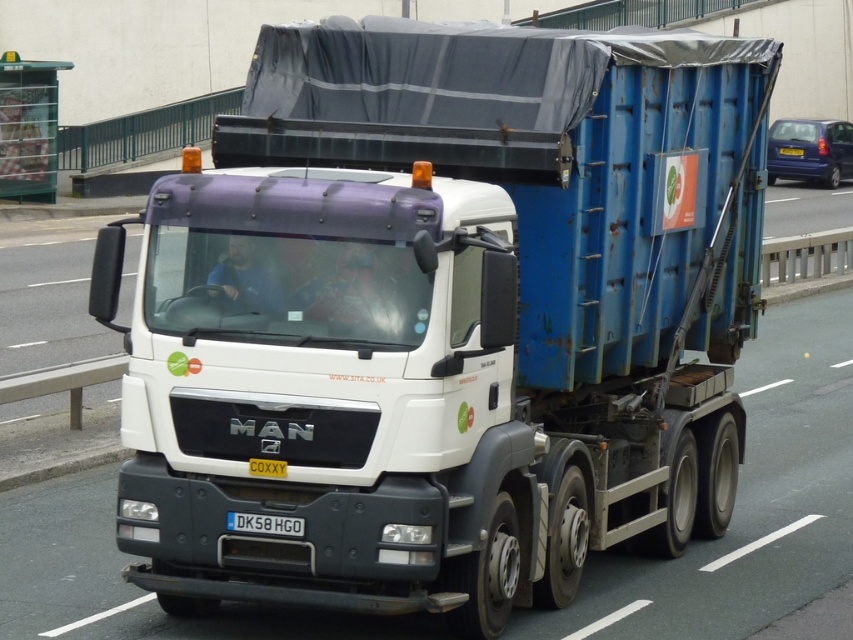
Does black plastic license plate at bottom have a lesser height compared to white plastic license plate at center?

Incorrect, black plastic license plate at bottom's height does not fall short of white plastic license plate at center's.

Which of these two, black plastic license plate at bottom or white plastic license plate at center, stands shorter?

white plastic license plate at center

Who is more forward, (x=270, y=529) or (x=257, y=472)?

Point (x=257, y=472) is in front.

You are a GUI agent. You are given a task and a screenshot of the screen. Output one action in this format:
    pyautogui.click(x=<x>, y=<y>)
    Task: Click on the black plastic license plate at bottom
    
    Given the screenshot: What is the action you would take?
    click(x=264, y=524)

From the picture: Is the position of white plastic license plate at center less distant than that of yellow metallic license plate at center?

Yes, white plastic license plate at center is closer to the viewer.

Does white plastic license plate at center have a larger size compared to yellow metallic license plate at center?

No.

Does point (276, 467) come behind point (791, 148)?

No, (276, 467) is in front of (791, 148).

Find the location of a particular element. white plastic license plate at center is located at coordinates (267, 467).

Identify the location of black plastic license plate at bottom. The image size is (853, 640). (264, 524).

Between point (303, 525) and point (793, 156), which one is positioned behind?

The point (793, 156) is more distant.

The height and width of the screenshot is (640, 853). Find the location of `black plastic license plate at bottom`. black plastic license plate at bottom is located at coordinates (264, 524).